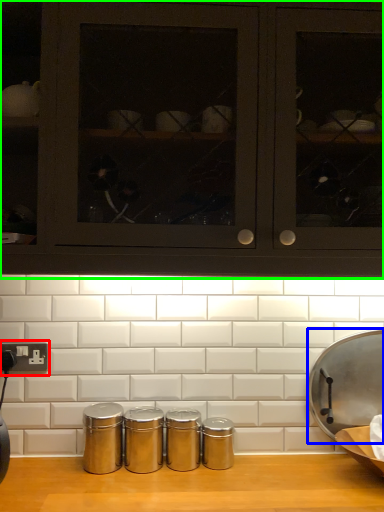
Question: Considering the real-world distances, which object is farthest from electric outlet (highlighted by a red box)? wide (highlighted by a blue box) or cabinetry (highlighted by a green box)?

Choices:
 (A) wide
 (B) cabinetry

Answer: (A)